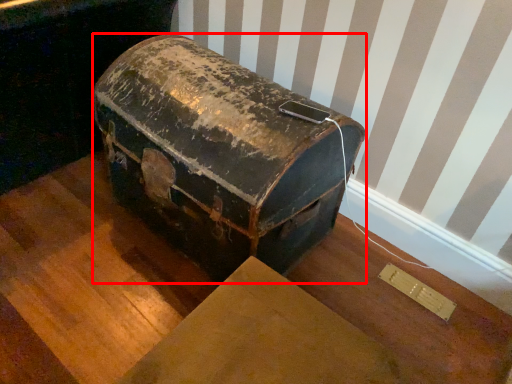
Question: From the image, what is the correct spatial relationship of suitcase (annotated by the red box) in relation to furniture?

Choices:
 (A) left
 (B) right

Answer: (B)